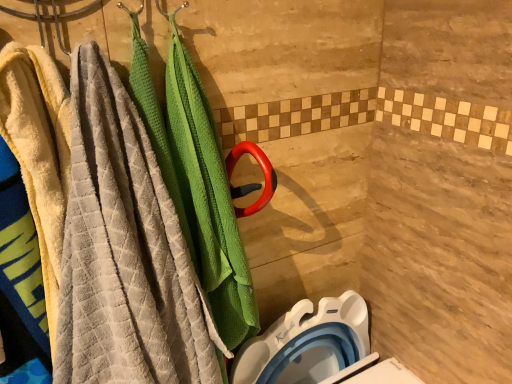
Question: Is white plastic toilet bowl at lower right looking in the opposite direction of soft yellow towel at left?

Choices:
 (A) yes
 (B) no

Answer: (B)

Question: Is white plastic toilet bowl at lower right shorter than soft yellow towel at left?

Choices:
 (A) no
 (B) yes

Answer: (B)

Question: From the image's perspective, does white plastic toilet bowl at lower right appear lower than soft yellow towel at left?

Choices:
 (A) yes
 (B) no

Answer: (A)

Question: From the image's perspective, is white plastic toilet bowl at lower right on top of soft yellow towel at left?

Choices:
 (A) no
 (B) yes

Answer: (A)

Question: Could soft yellow towel at left be considered to be inside white plastic toilet bowl at lower right?

Choices:
 (A) no
 (B) yes

Answer: (A)

Question: Choose the correct answer: Is soft yellow towel at left inside textured gray towel at left or outside it?

Choices:
 (A) outside
 (B) inside

Answer: (B)

Question: From a real-world perspective, is soft yellow towel at left above or below textured gray towel at left?

Choices:
 (A) above
 (B) below

Answer: (A)

Question: Considering the positions of soft yellow towel at left and textured gray towel at left in the image, is soft yellow towel at left bigger or smaller than textured gray towel at left?

Choices:
 (A) big
 (B) small

Answer: (B)

Question: Looking at their shapes, would you say soft yellow towel at left is wider or thinner than textured gray towel at left?

Choices:
 (A) wide
 (B) thin

Answer: (B)

Question: Considering the positions of textured gray towel at left and white plastic toilet bowl at lower right in the image, is textured gray towel at left taller or shorter than white plastic toilet bowl at lower right?

Choices:
 (A) tall
 (B) short

Answer: (A)

Question: In the image, is textured gray towel at left positioned in front of or behind white plastic toilet bowl at lower right?

Choices:
 (A) behind
 (B) front

Answer: (B)

Question: Is textured gray towel at left inside or outside of white plastic toilet bowl at lower right?

Choices:
 (A) outside
 (B) inside

Answer: (A)

Question: Is textured gray towel at left wider or thinner than white plastic toilet bowl at lower right?

Choices:
 (A) wide
 (B) thin

Answer: (A)

Question: Looking at the image, does soft yellow towel at left seem bigger or smaller compared to white plastic toilet bowl at lower right?

Choices:
 (A) big
 (B) small

Answer: (A)

Question: Is soft yellow towel at left taller or shorter than white plastic toilet bowl at lower right?

Choices:
 (A) tall
 (B) short

Answer: (A)